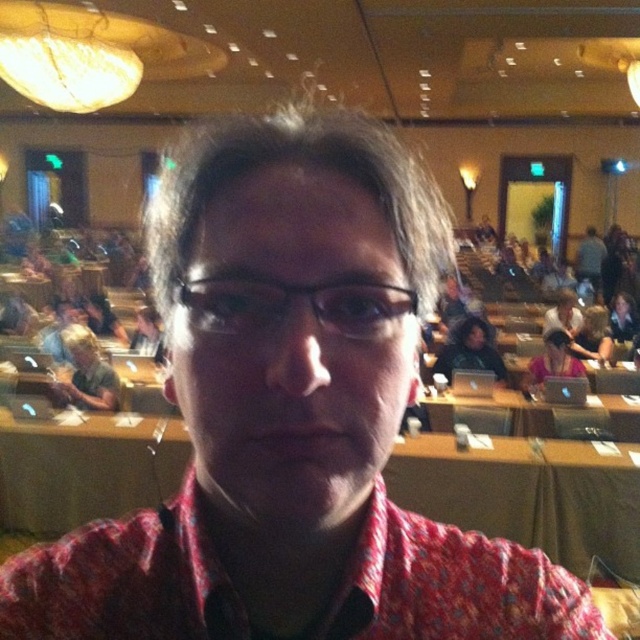
Question: Which object is the farthest from the black plastic glasses at center?

Choices:
 (A) wooden table at center
 (B) matte black laptop at upper right

Answer: (B)

Question: Can you confirm if black plastic glasses at center is thinner than matte black laptop at upper right?

Choices:
 (A) no
 (B) yes

Answer: (B)

Question: Can you confirm if wooden table at center is positioned to the right of black plastic glasses at center?

Choices:
 (A) yes
 (B) no

Answer: (A)

Question: Which point is farther to the camera?

Choices:
 (A) (374, 324)
 (B) (584, 234)
 (C) (88, 440)

Answer: (B)

Question: Which object is the farthest from the black plastic glasses at center?

Choices:
 (A) matte black laptop at upper right
 (B) wooden table at center

Answer: (A)

Question: Can you confirm if black plastic glasses at center is bigger than matte black laptop at upper right?

Choices:
 (A) no
 (B) yes

Answer: (A)